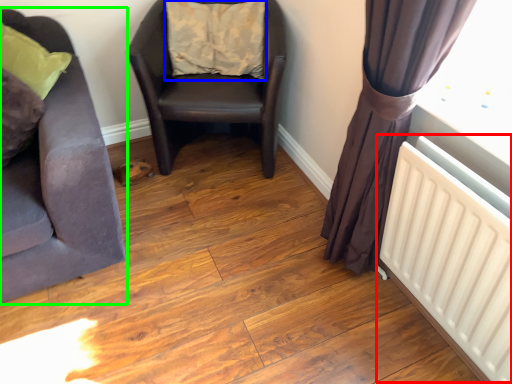
Question: Based on their relative distances, which object is nearer to radiator (highlighted by a red box)? Choose from pillow (highlighted by a blue box) and chair (highlighted by a green box).

Choices:
 (A) pillow
 (B) chair

Answer: (B)